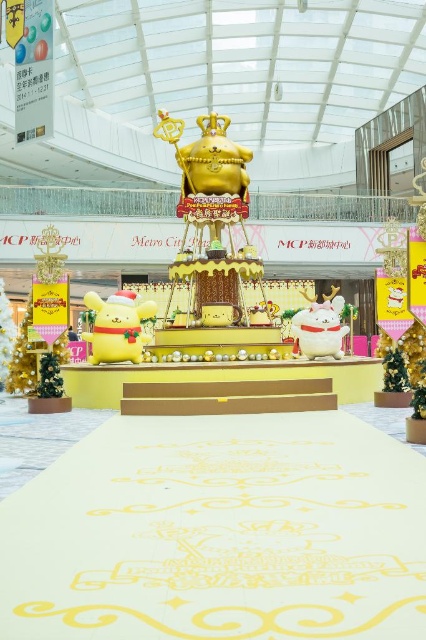
In the scene shown: Who is positioned more to the left, yellow plush toy at center or white plush cat at center?

yellow plush toy at center is more to the left.

Does yellow plush toy at center appear under white plush cat at center?

Yes, yellow plush toy at center is below white plush cat at center.

The image size is (426, 640). I want to click on yellow plush toy at center, so click(x=117, y=326).